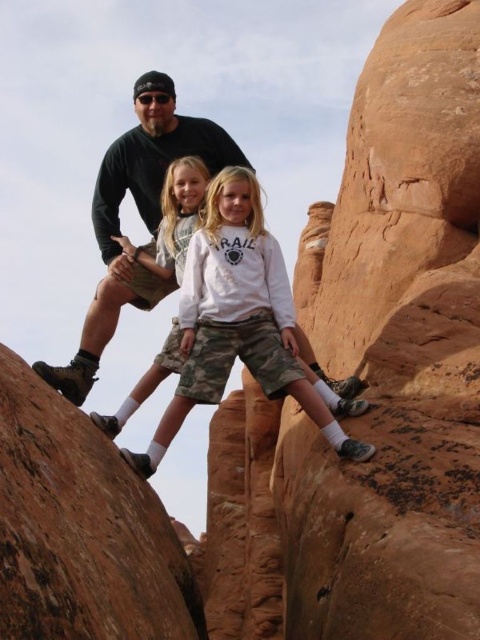
Question: Is dark green t-shirt at center above camouflage shorts at center?

Choices:
 (A) yes
 (B) no

Answer: (A)

Question: Which object is positioned farthest from the white cotton shirt at center?

Choices:
 (A) rustic sandstone arch at right
 (B) camouflage shorts at center
 (C) brown rough rock at upper left

Answer: (C)

Question: From the image, what is the correct spatial relationship of rustic sandstone arch at right in relation to camouflage shorts at center?

Choices:
 (A) right
 (B) left

Answer: (A)

Question: Among these objects, which one is nearest to the camera?

Choices:
 (A) camouflage shorts at center
 (B) brown rough rock at upper left

Answer: (B)

Question: Among these points, which one is farthest from the camera?

Choices:
 (A) (x=179, y=328)
 (B) (x=180, y=304)

Answer: (A)

Question: In this image, where is rustic sandstone arch at right located relative to brown rough rock at upper left?

Choices:
 (A) below
 (B) above

Answer: (B)